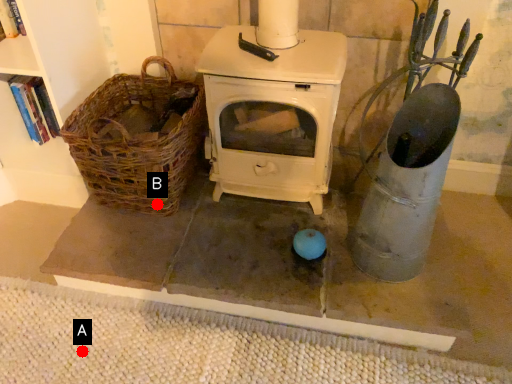
Question: Two points are circled on the image, labeled by A and B beside each circle. Among these points, which one is nearest to the camera?

Choices:
 (A) A is closer
 (B) B is closer

Answer: (A)